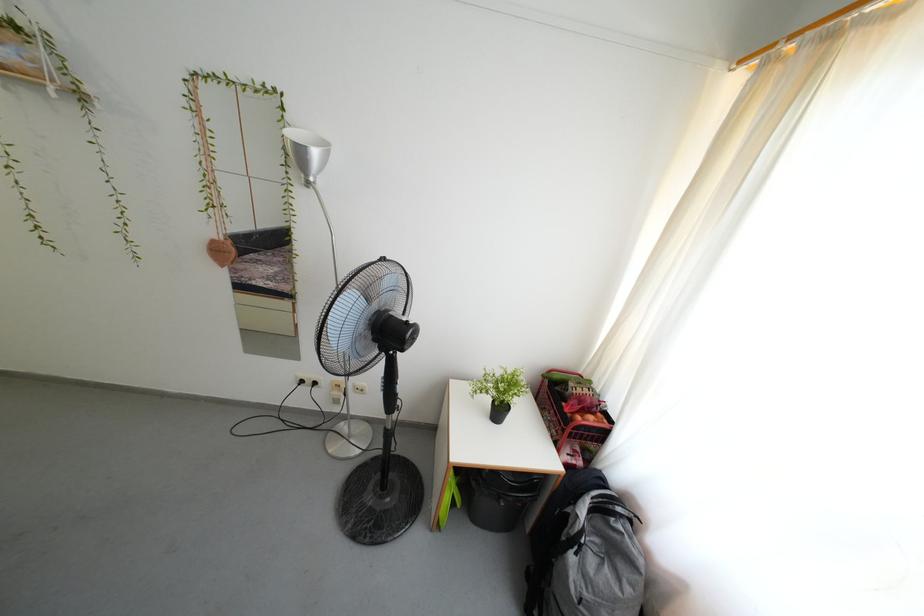
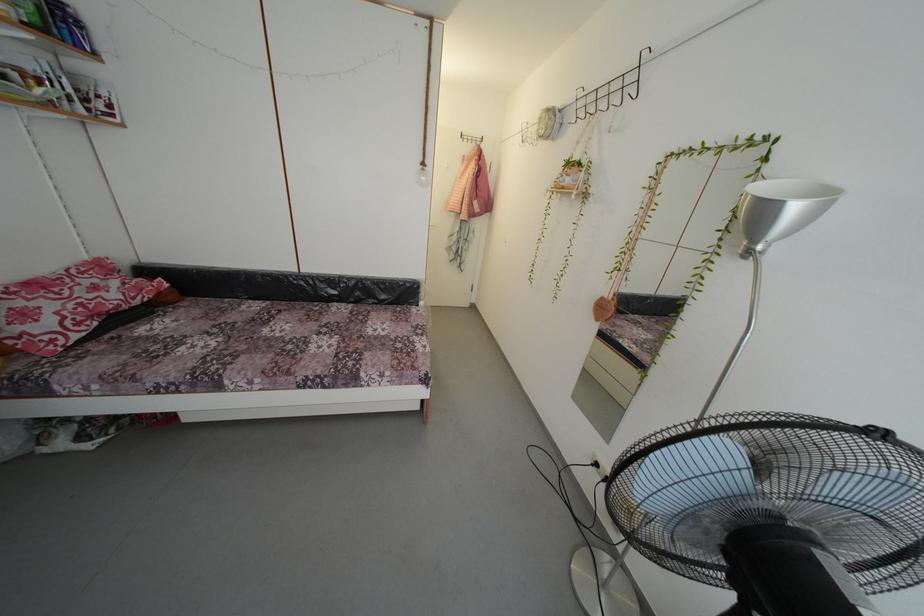
Question: The images are taken continuously from a first-person perspective. In which direction is your viewpoint rotating?

Choices:
 (A) Left
 (B) Right
 (C) Up
 (D) Down

Answer: (A)